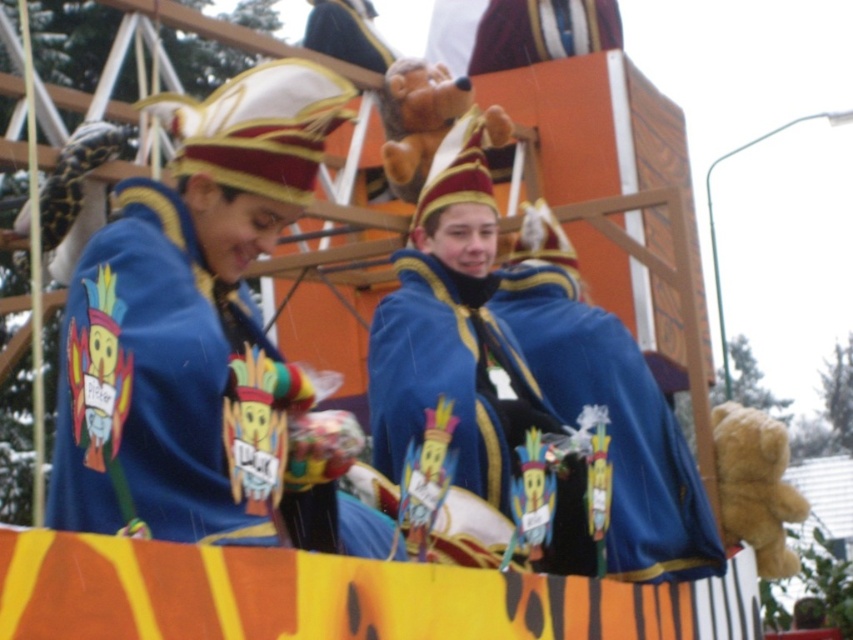
Who is higher up, blue velvet cape at center or matte blue cape at center?

Positioned higher is blue velvet cape at center.

Is point (180, 195) positioned in front of point (486, 449)?

That is True.

Where is `blue velvet cape at center`? This screenshot has height=640, width=853. blue velvet cape at center is located at coordinates (199, 333).